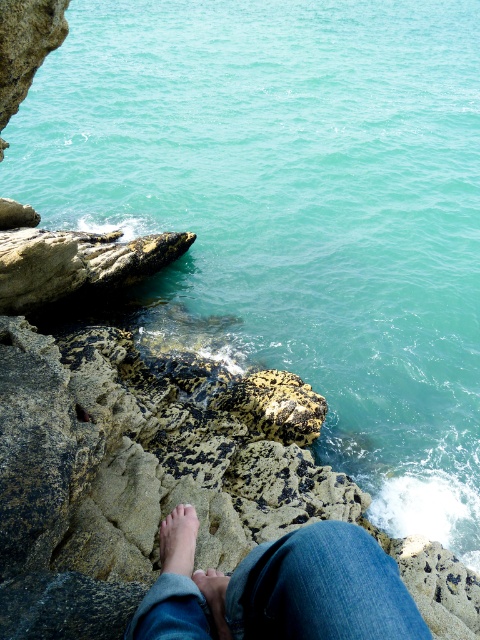
Measure the distance from blue jeans at lower center to light brown leather foot at lower center.

A distance of 12.70 inches exists between blue jeans at lower center and light brown leather foot at lower center.

Is point (134, 637) closer to camera compared to point (223, 595)?

Yes, it is in front of point (223, 595).

In order to click on blue jeans at lower center in this screenshot , I will do `click(280, 589)`.

Between blue jeans at lower center and pink flesh at center, which one has less height?

Standing shorter between the two is pink flesh at center.

Is blue jeans at lower center closer to camera compared to pink flesh at center?

Yes, it is in front of pink flesh at center.

What do you see at coordinates (280, 589) in the screenshot? I see `blue jeans at lower center` at bounding box center [280, 589].

This screenshot has width=480, height=640. In order to click on blue jeans at lower center in this screenshot , I will do `click(280, 589)`.

Is light brown leather foot at lower center to the left of pink flesh at center from the viewer's perspective?

In fact, light brown leather foot at lower center is to the right of pink flesh at center.

Is point (224, 627) positioned in front of point (197, 568)?

Yes, point (224, 627) is in front of point (197, 568).

What are the coordinates of `light brown leather foot at lower center` in the screenshot? It's located at (216, 600).